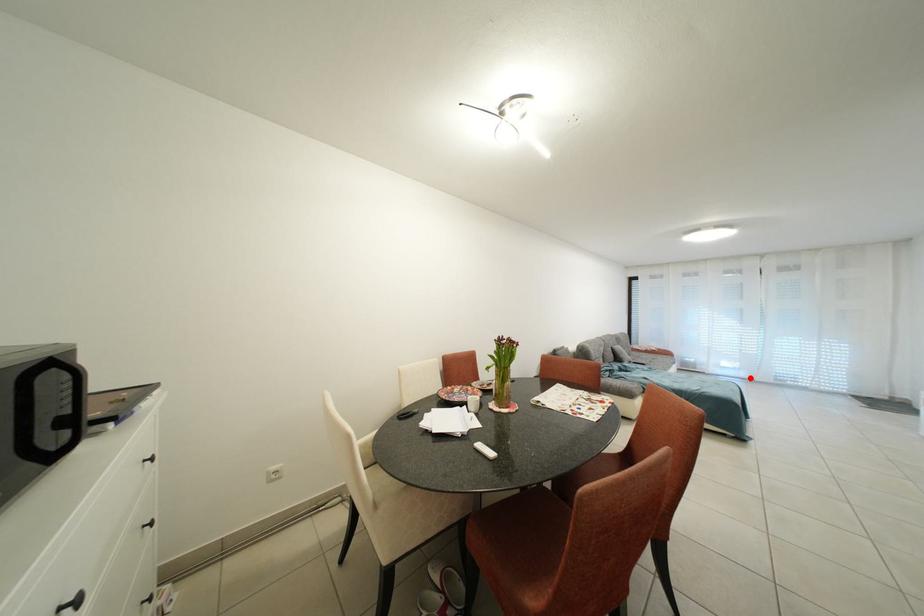
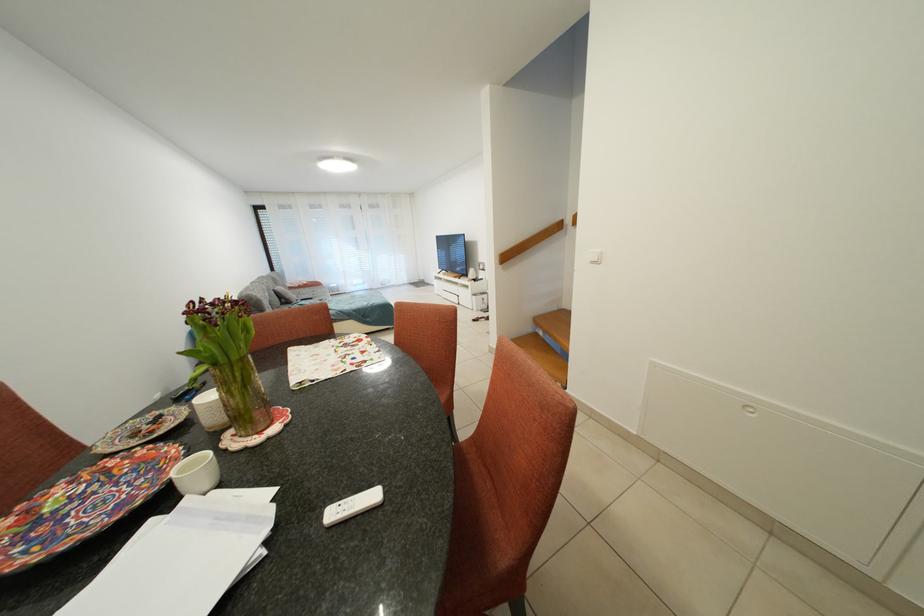
Locate, in the second image, the point that corresponds to the highlighted location in the first image.

(373, 291)